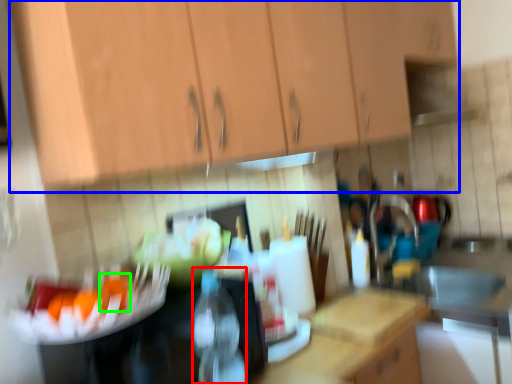
Question: Based on their relative distances, which object is farther from bottle (highlighted by a red box)? Choose from cabinetry (highlighted by a blue box) and food (highlighted by a green box).

Choices:
 (A) cabinetry
 (B) food

Answer: (A)